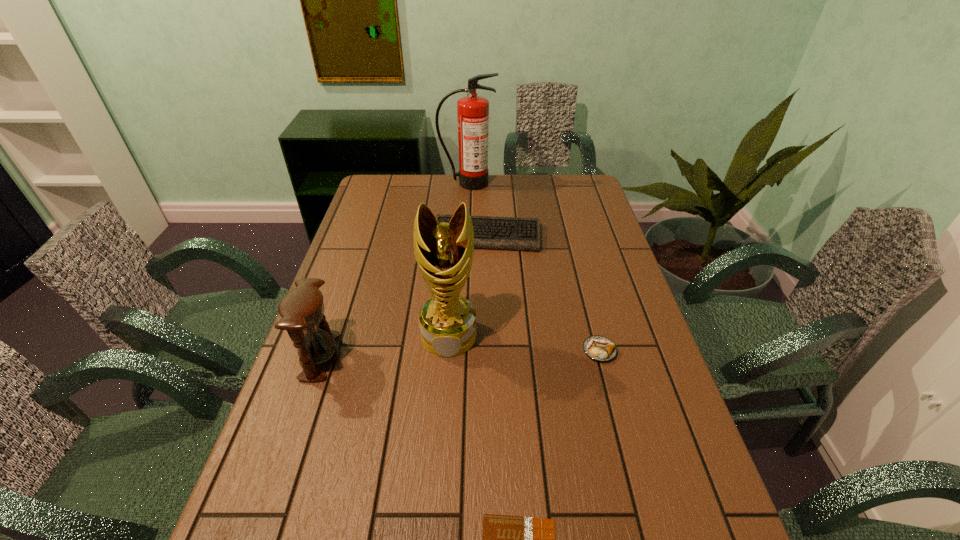
Locate an element on the screen. This screenshot has height=540, width=960. fire extinguisher is located at coordinates 472,111.

Where is `award`? This screenshot has height=540, width=960. award is located at coordinates (444, 251).

Where is `the leftmost object`? the leftmost object is located at coordinates (302, 309).

The height and width of the screenshot is (540, 960). Find the location of `hourglass`. hourglass is located at coordinates (302, 309).

Find the location of a particular element. Image resolution: width=960 pixels, height=540 pixels. the third shortest object is located at coordinates (497, 233).

Image resolution: width=960 pixels, height=540 pixels. Identify the location of computer keyboard. (497, 233).

The image size is (960, 540). In order to click on pastry in this screenshot , I will do `click(599, 348)`.

Identify the location of the rightmost object. This screenshot has height=540, width=960. (599, 348).

Image resolution: width=960 pixels, height=540 pixels. I want to click on vacant space located 0.340m on the front-facing side of the farthest object, so click(465, 240).

The width and height of the screenshot is (960, 540). In order to click on vacant area situated on the front-facing side of the award in this screenshot , I will do `click(437, 503)`.